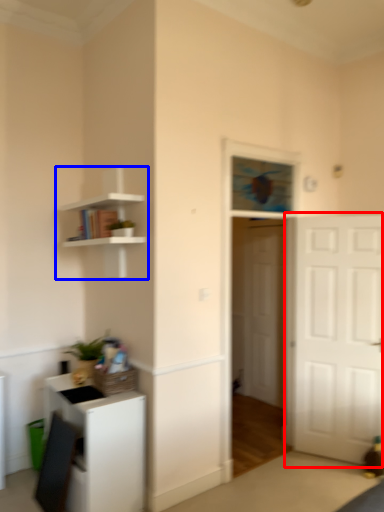
Question: Which object is further to the camera taking this photo, door (highlighted by a red box) or shelf (highlighted by a blue box)?

Choices:
 (A) door
 (B) shelf

Answer: (A)